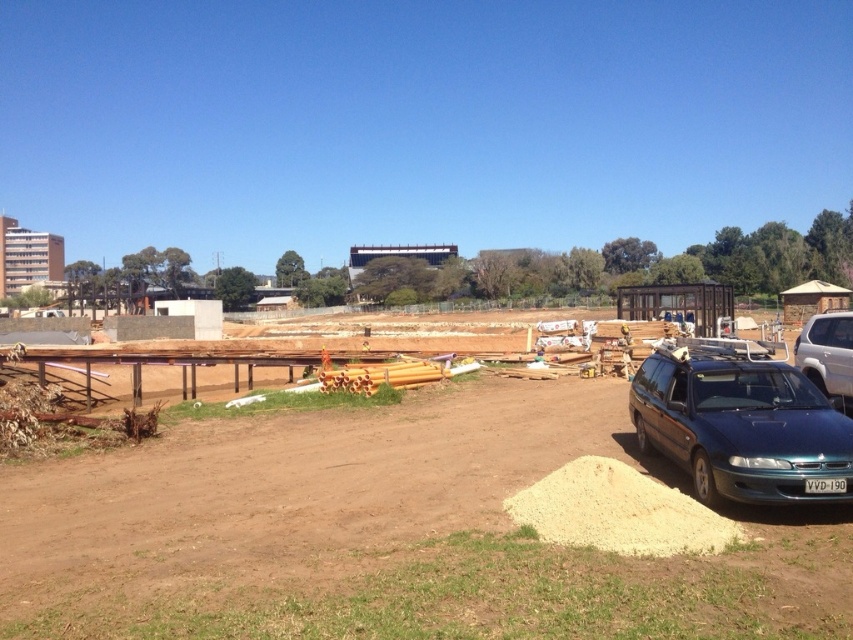
You are a delivery driver who needs to park your vehicle in the construction site. You see a satin white suv at right and a white plastic license plate at lower right. Which object is closer to the entrance of the construction site?

The white plastic license plate at lower right is closer to the entrance of the construction site because the satin white suv at right is to the right of it, implying the license plate is positioned nearer to the entrance area.

You are a delivery driver who needs to park your truck next to the metallic blue station wagon at lower right. Your truck is 2 meters tall. Can you safely park next to it without hitting the white plastic license plate at lower right?

The metallic blue station wagon at lower right is taller than the white plastic license plate at lower right. Since your truck is 2 meters tall, you need to ensure there is enough clearance. However, the exact height of the station wagon isn

You are a delivery driver who needs to park your vehicle in this construction site. The parking spot is located at the coordinates point [827,355]. However, there is a satin white suv at right currently occupying that spot. Can you park your vehicle there?

The parking spot at point [827,355] is currently occupied by the satin white suv at right, so you cannot park there.